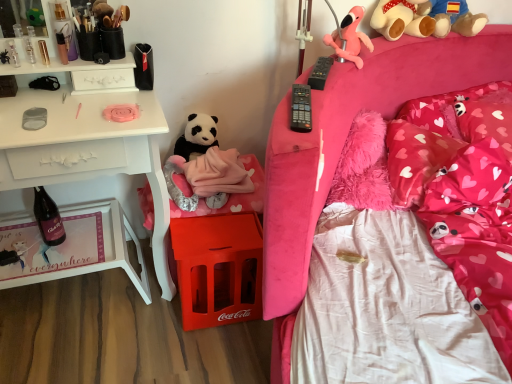
Question: From a real-world perspective, is clear plastic bottles at upper left, the 3th toiletry when ordered from right to left, located beneath metallic gold lip balm at upper left, arranged as the second toiletry when viewed from the right?

Choices:
 (A) yes
 (B) no

Answer: (B)

Question: From the image's perspective, is clear plastic bottles at upper left, the 3th toiletry when ordered from right to left, over metallic gold lip balm at upper left, arranged as the second toiletry when viewed from the right?

Choices:
 (A) no
 (B) yes

Answer: (B)

Question: From a real-world perspective, is clear plastic bottles at upper left, the first toiletry positioned from the left, on metallic gold lip balm at upper left, positioned as the second toiletry in left-to-right order?

Choices:
 (A) yes
 (B) no

Answer: (A)

Question: Considering the relative sizes of clear plastic bottles at upper left, the first toiletry positioned from the left, and metallic gold lip balm at upper left, arranged as the second toiletry when viewed from the right, in the image provided, is clear plastic bottles at upper left, the first toiletry positioned from the left, shorter than metallic gold lip balm at upper left, arranged as the second toiletry when viewed from the right,?

Choices:
 (A) no
 (B) yes

Answer: (A)

Question: Is clear plastic bottles at upper left, the 3th toiletry when ordered from right to left, taller than metallic gold lip balm at upper left, arranged as the second toiletry when viewed from the right?

Choices:
 (A) yes
 (B) no

Answer: (A)

Question: Relative to translucent plastic lip balm at upper left, placed as the 1th toiletry when sorted from right to left, is shiny white tray at lower left in front or behind?

Choices:
 (A) behind
 (B) front

Answer: (A)

Question: Is shiny white tray at lower left inside the boundaries of translucent plastic lip balm at upper left, the third toiletry positioned from the left, or outside?

Choices:
 (A) outside
 (B) inside

Answer: (A)

Question: Does point (111, 263) appear closer or farther from the camera than point (64, 44)?

Choices:
 (A) farther
 (B) closer

Answer: (A)

Question: From a real-world perspective, relative to translucent plastic lip balm at upper left, the third toiletry positioned from the left, is shiny white tray at lower left vertically above or below?

Choices:
 (A) below
 (B) above

Answer: (A)

Question: Considering their positions, is matte glass bottle at lower left located in front of or behind red plastic crate at lower center?

Choices:
 (A) behind
 (B) front

Answer: (A)

Question: Is matte glass bottle at lower left taller or shorter than red plastic crate at lower center?

Choices:
 (A) short
 (B) tall

Answer: (A)

Question: Looking at their shapes, would you say matte glass bottle at lower left is wider or thinner than red plastic crate at lower center?

Choices:
 (A) thin
 (B) wide

Answer: (A)

Question: From the image's perspective, is matte glass bottle at lower left positioned above or below red plastic crate at lower center?

Choices:
 (A) below
 (B) above

Answer: (B)

Question: Considering the positions of clear plastic bottles at upper left, the 3th toiletry when ordered from right to left, and brown plush teddy bear at upper right in the image, is clear plastic bottles at upper left, the 3th toiletry when ordered from right to left, bigger or smaller than brown plush teddy bear at upper right?

Choices:
 (A) small
 (B) big

Answer: (A)

Question: Considering the positions of point (29, 56) and point (434, 9), is point (29, 56) closer or farther from the camera than point (434, 9)?

Choices:
 (A) farther
 (B) closer

Answer: (B)